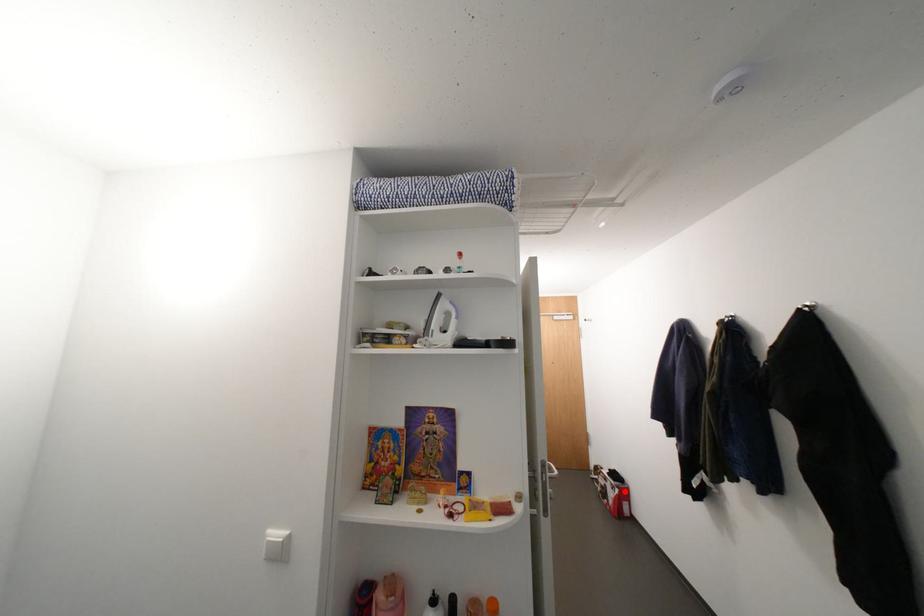
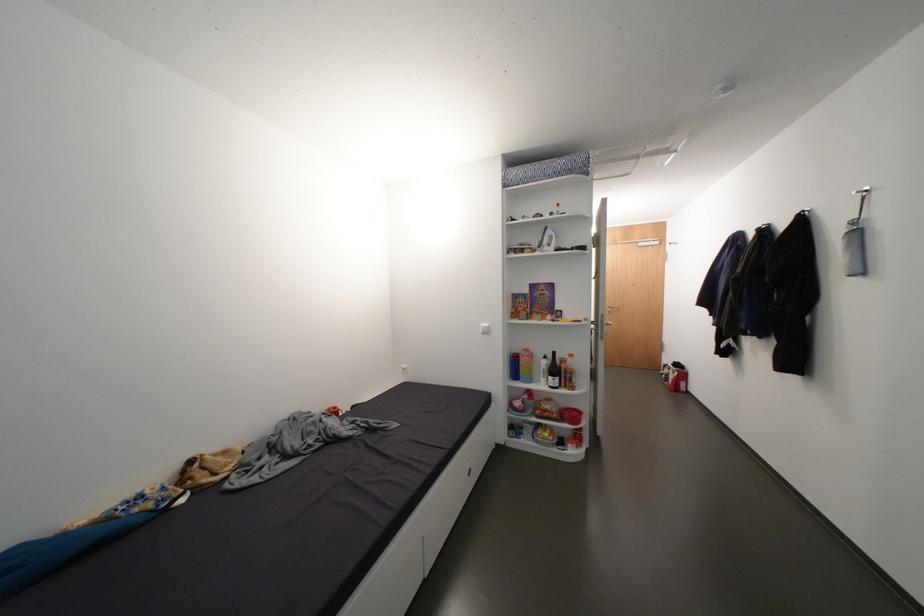
Question: I am providing you with two images of the same scene from different viewpoints. A red point is marked on the first image. At the location where the point appears in image 1, is it still visible in image 2?

Choices:
 (A) Yes
 (B) No

Answer: (A)